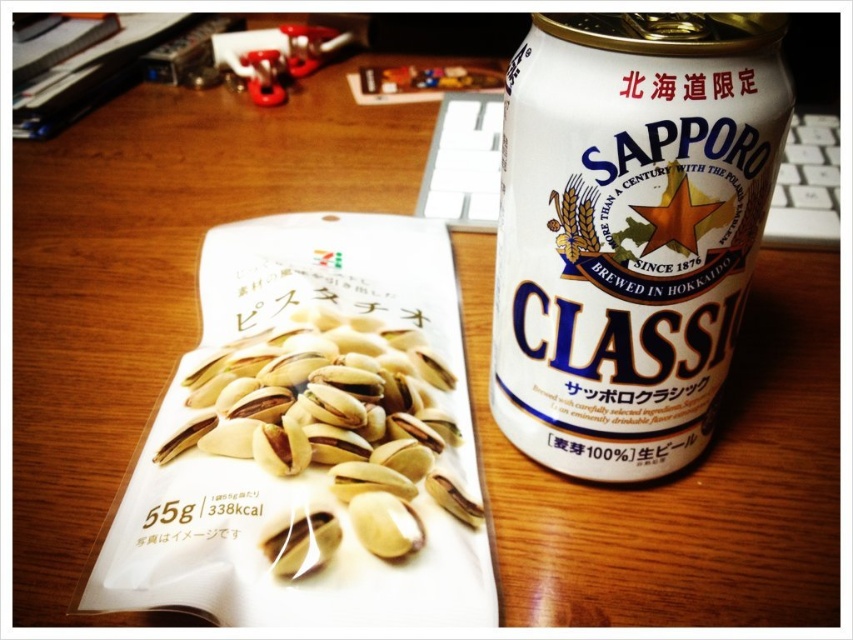
Does point (679, 316) come closer to viewer compared to point (363, 536)?

Yes, it is in front of point (363, 536).

Measure the distance between point (556, 157) and camera.

Point (556, 157) is 23.92 inches from camera.

Locate an element on the screen. white matte can at right is located at coordinates (630, 230).